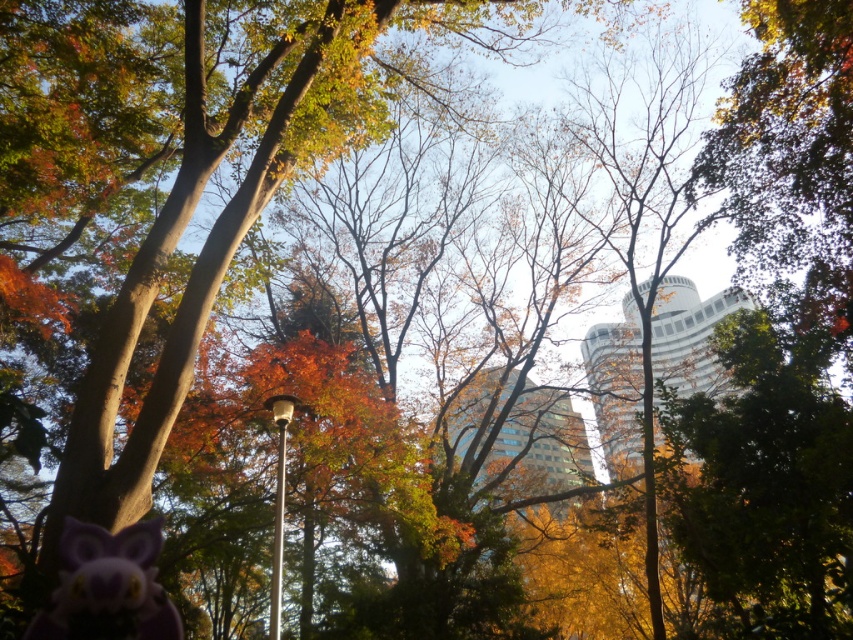
Question: Does white glossy tower at center appear on the left side of glassy blue skyscraper at center?

Choices:
 (A) no
 (B) yes

Answer: (A)

Question: Among these points, which one is nearest to the camera?

Choices:
 (A) (695, 362)
 (B) (561, 499)

Answer: (B)

Question: Which of the following is the farthest from the observer?

Choices:
 (A) (540, 410)
 (B) (672, 291)

Answer: (B)

Question: Can you confirm if white glossy tower at center is thinner than glassy blue skyscraper at center?

Choices:
 (A) yes
 (B) no

Answer: (B)

Question: Which object appears closest to the camera in this image?

Choices:
 (A) glassy blue skyscraper at center
 (B) white glossy tower at center

Answer: (B)

Question: Where is white glossy tower at center located in relation to glassy blue skyscraper at center in the image?

Choices:
 (A) right
 (B) left

Answer: (A)